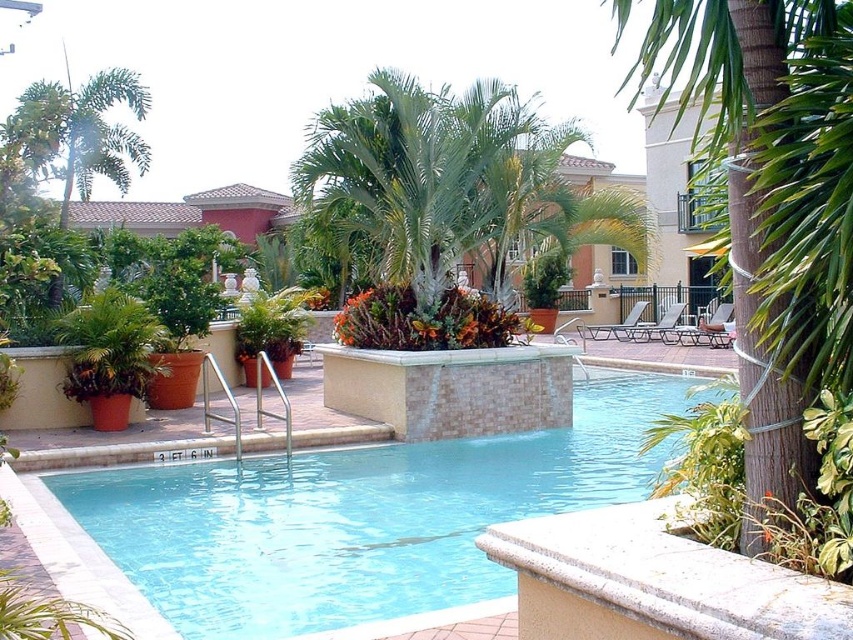
Can you confirm if clear blue water at center is thinner than green leafy palm tree at center?

No, clear blue water at center is not thinner than green leafy palm tree at center.

Can you confirm if clear blue water at center is taller than green leafy palm tree at center?

No, clear blue water at center is not taller than green leafy palm tree at center.

Who is more forward, [358,605] or [729,100]?

Point [729,100] is in front.

At what (x,y) coordinates should I click in order to perform the action: click on clear blue water at center. Please return your answer as a coordinate pair (x, y). This screenshot has width=853, height=640. Looking at the image, I should click on (361, 516).